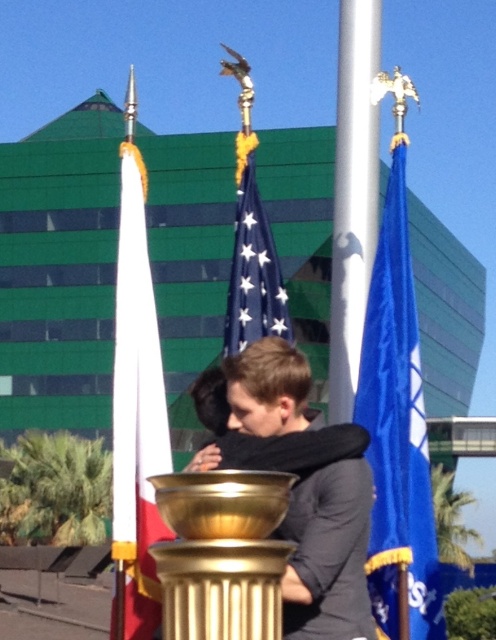
You are standing at the center of the scene looking towards the golden pedestal with the bowl. Which direction should you turn to face the white fabric flag at left?

The white fabric flag at left is located at point (135, 413), which is to the left side of the scene. To face it, you should turn to your left from the center position.

In the scene shown: You are an observer standing in front of the golden pedestal with a bowl. You notice two items in the scene. One is the dark gray sweater at center and the other is the blue fabric flag at center. Which item is taller?

The dark gray sweater at center is taller than the blue fabric flag at center.